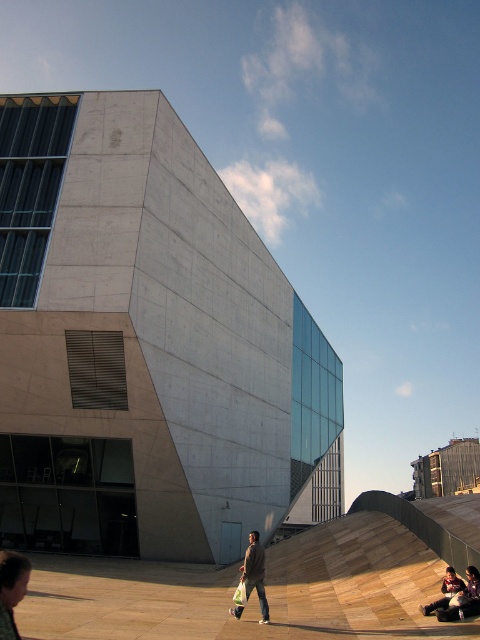
Question: Which of the following is the closest to the observer?

Choices:
 (A) denim jacket at center
 (B) light brown leather jacket at lower left

Answer: (B)

Question: Is light brown leather jacket at lower left wider than denim jacket at center?

Choices:
 (A) no
 (B) yes

Answer: (A)

Question: Which point is closer to the camera taking this photo?

Choices:
 (A) (257, 596)
 (B) (1, 636)

Answer: (B)

Question: Is light brown leather jacket at lower left to the left of denim jacket at center from the viewer's perspective?

Choices:
 (A) yes
 (B) no

Answer: (A)

Question: Among these objects, which one is nearest to the camera?

Choices:
 (A) light brown leather jacket at lower left
 (B) denim jacket at center

Answer: (A)

Question: Can you confirm if light brown leather jacket at lower left is thinner than denim jacket at center?

Choices:
 (A) yes
 (B) no

Answer: (A)